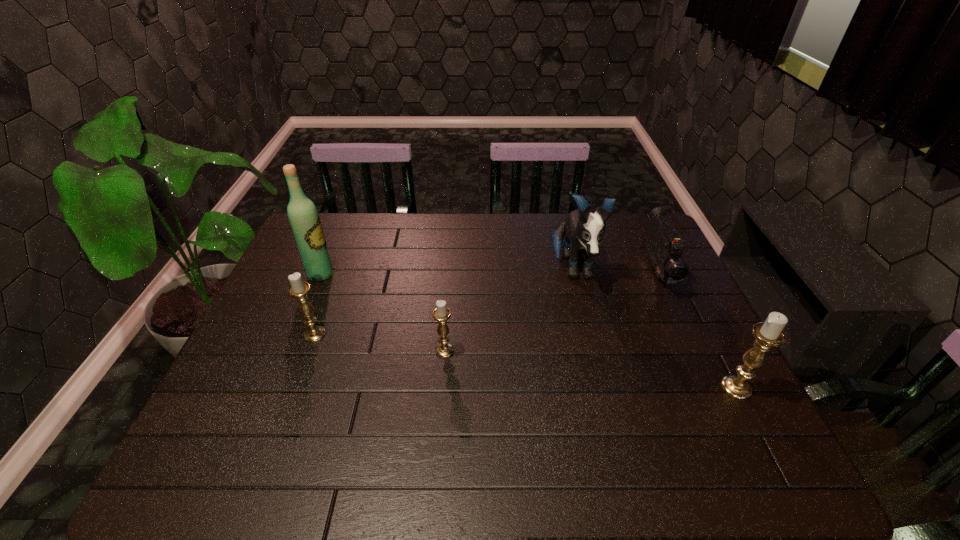
Where is `unoccupied position between the second nearest candle holder and the nearest candle holder`? The width and height of the screenshot is (960, 540). unoccupied position between the second nearest candle holder and the nearest candle holder is located at coordinates (590, 369).

Choose which object is the fourth nearest neighbor to the rightmost candle holder. Please provide its 2D coordinates. Your answer should be formatted as a tuple, i.e. [(x, y)], where the tuple contains the x and y coordinates of a point satisfying the conditions above.

[(298, 289)]

Point out which object is positioned as the fourth nearest to the wine bottle. Please provide its 2D coordinates. Your answer should be formatted as a tuple, i.e. [(x, y)], where the tuple contains the x and y coordinates of a point satisfying the conditions above.

[(664, 245)]

Where is `candle holder that can be found as the third closest to the second tallest object`? This screenshot has height=540, width=960. candle holder that can be found as the third closest to the second tallest object is located at coordinates (298, 289).

At what (x,y) coordinates should I click in order to perform the action: click on candle holder that is the second nearest to the fifth shortest object. Please return your answer as a coordinate pair (x, y). The image size is (960, 540). Looking at the image, I should click on (768, 334).

This screenshot has width=960, height=540. What are the coordinates of `free spot that satisfies the following two spatial constraints: 1. on the front-facing side of the wine bottle; 2. on the right side of the farthest candle holder` in the screenshot? It's located at (x=296, y=334).

Locate an element on the screen. The height and width of the screenshot is (540, 960). blank area in the image that satisfies the following two spatial constraints: 1. on the front-facing side of the camcorder; 2. on the front-facing side of the wine bottle is located at coordinates (659, 274).

Locate an element on the screen. free region that satisfies the following two spatial constraints: 1. on the front-facing side of the wine bottle; 2. on the back side of the second tallest candle holder is located at coordinates (296, 334).

Where is `vacant space that satisfies the following two spatial constraints: 1. on the back side of the nearest candle holder; 2. on the front-facing side of the wine bottle`? This screenshot has width=960, height=540. vacant space that satisfies the following two spatial constraints: 1. on the back side of the nearest candle holder; 2. on the front-facing side of the wine bottle is located at coordinates (678, 274).

You are a GUI agent. You are given a task and a screenshot of the screen. Output one action in this format:
    pyautogui.click(x=<x>, y=<y>)
    Task: Click on the vacant point that satisfies the following two spatial constraints: 1. on the front-facing side of the wine bottle; 2. on the right side of the nearest candle holder
    The height and width of the screenshot is (540, 960).
    Given the screenshot: What is the action you would take?
    pyautogui.click(x=274, y=388)